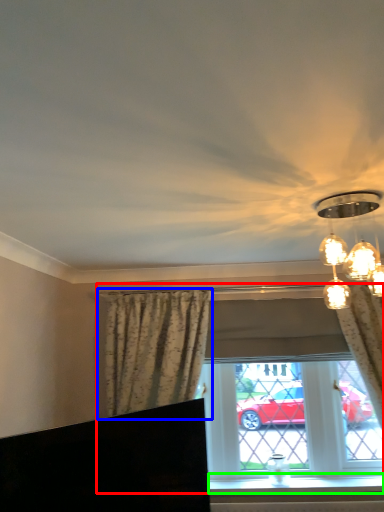
Question: Which object is positioned farthest from window (highlighted by a red box)? Select from curtain (highlighted by a blue box) and window sill (highlighted by a green box).

Choices:
 (A) curtain
 (B) window sill

Answer: (A)